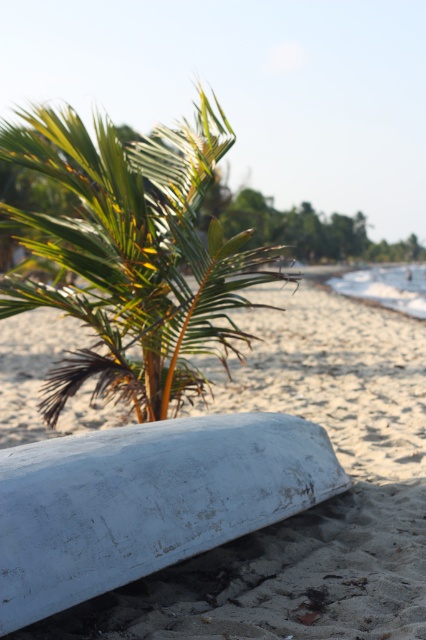
You are planning to set up a small tent on the white sandy beach at lower center. Considering the space available, will the beach be wide enough to accommodate the tent without it being too close to the green leafy palm tree at center?

The white sandy beach at lower center is narrower than the green leafy palm tree at center, so the beach may not be wide enough to place the tent far from the palm tree. Consider checking the available space before setting up.